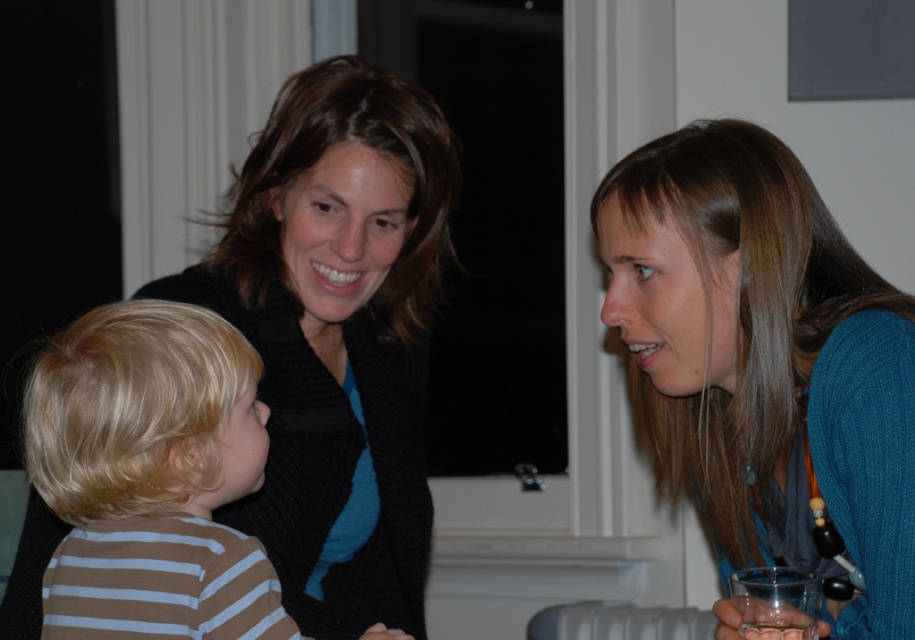
Question: Considering the relative positions of blue knitted sweater at right and brown striped shirt at lower left in the image provided, where is blue knitted sweater at right located with respect to brown striped shirt at lower left?

Choices:
 (A) right
 (B) left

Answer: (A)

Question: From the image, what is the correct spatial relationship of blue knitted sweater at right in relation to brown striped shirt at lower left?

Choices:
 (A) left
 (B) right

Answer: (B)

Question: Which of these objects is positioned closest to the blue knitted sweater at right?

Choices:
 (A) matte black sweater at upper left
 (B) transparent plastic glass at lower right
 (C) brown striped shirt at lower left

Answer: (B)

Question: Which point appears closest to the camera in this image?

Choices:
 (A) (792, 609)
 (B) (101, 547)
 (C) (630, 339)

Answer: (B)

Question: Is blue knitted sweater at right below brown striped shirt at lower left?

Choices:
 (A) yes
 (B) no

Answer: (B)

Question: Which point is farther to the camera?

Choices:
 (A) matte black sweater at upper left
 (B) blue knitted sweater at right
 (C) transparent plastic glass at lower right

Answer: (A)